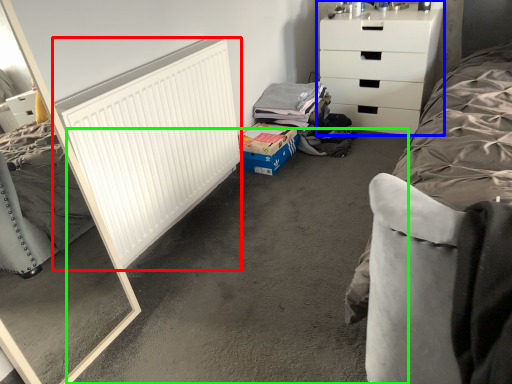
Question: Which is nearer to the radiator (highlighted by a red box)? chest of drawers (highlighted by a blue box) or concrete (highlighted by a green box).

Choices:
 (A) chest of drawers
 (B) concrete

Answer: (B)